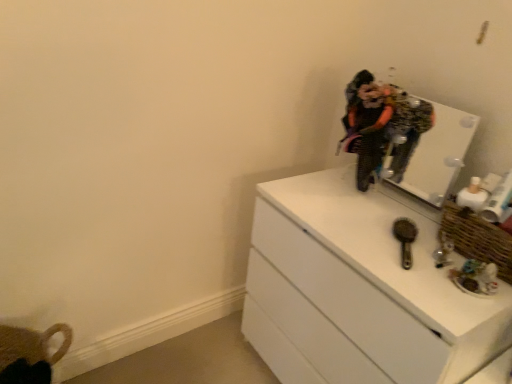
Where is `free space between metallic brown brush at center-right and textured black dress at center`? The image size is (512, 384). free space between metallic brown brush at center-right and textured black dress at center is located at coordinates tap(373, 214).